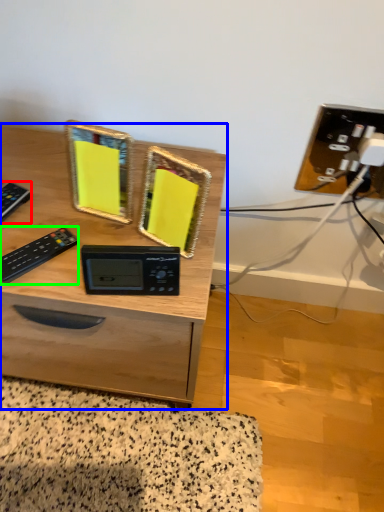
Question: Estimate the real-world distances between objects in this image. Which object is farther from control (highlighted by a red box), desk (highlighted by a blue box) or control (highlighted by a green box)?

Choices:
 (A) desk
 (B) control

Answer: (A)